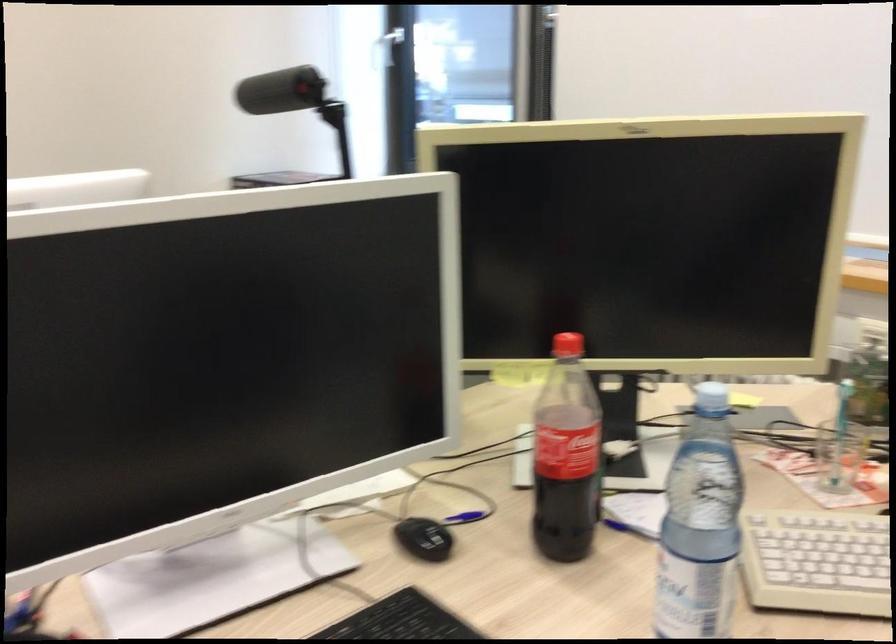
At what (x,y) coordinates should I click in order to perform the action: click on black computer mouse. Please return your answer as a coordinate pair (x, y). The image size is (896, 644). Looking at the image, I should click on point(424,538).